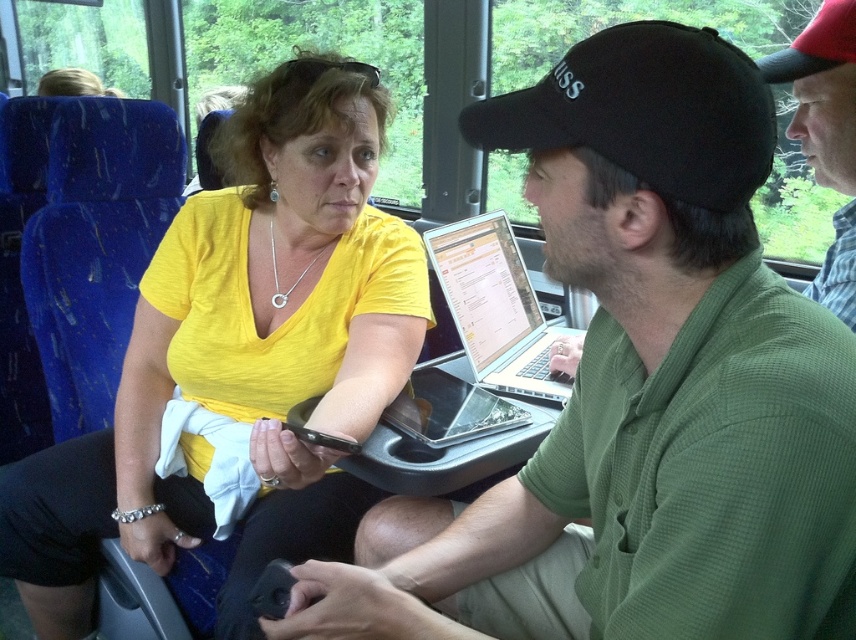
Is point (619, 164) more distant than point (480, 218)?

No, it is in front of (480, 218).

Is black mesh baseball cap at upper center positioned before silver metallic laptop at center?

Yes, it is in front of silver metallic laptop at center.

Which is behind, point (580, 115) or point (471, 340)?

Positioned behind is point (471, 340).

At what (x,y) coordinates should I click in order to perform the action: click on black mesh baseball cap at upper center. Please return your answer as a coordinate pair (x, y). This screenshot has width=856, height=640. Looking at the image, I should click on (646, 112).

Who is higher up, green plaid shirt at upper right or glossy silver laptop at center?

green plaid shirt at upper right is higher up.

Is green plaid shirt at upper right closer to camera compared to glossy silver laptop at center?

Yes, it is in front of glossy silver laptop at center.

Which is in front, point (854, 170) or point (391, 401)?

Positioned in front is point (854, 170).

Identify the location of green plaid shirt at upper right. (825, 134).

Which is behind, point (474, 376) or point (848, 269)?

Point (474, 376)

Does silver metallic laptop at center have a greater width compared to green plaid shirt at upper right?

Correct, the width of silver metallic laptop at center exceeds that of green plaid shirt at upper right.

Who is more distant from viewer, (535, 316) or (853, 212)?

Point (535, 316)

In order to click on silver metallic laptop at center in this screenshot , I will do `click(496, 307)`.